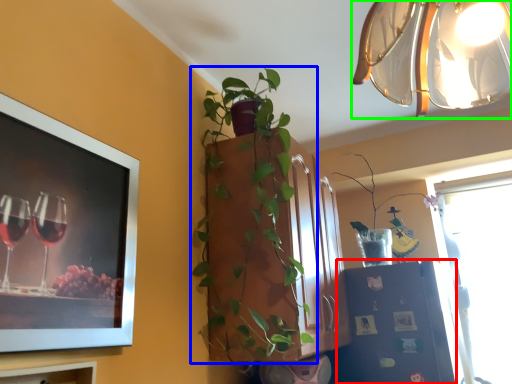
Question: Which object is positioned closest to shelf (highlighted by a red box)? Select from houseplant (highlighted by a blue box) and lamp (highlighted by a green box).

Choices:
 (A) houseplant
 (B) lamp

Answer: (A)